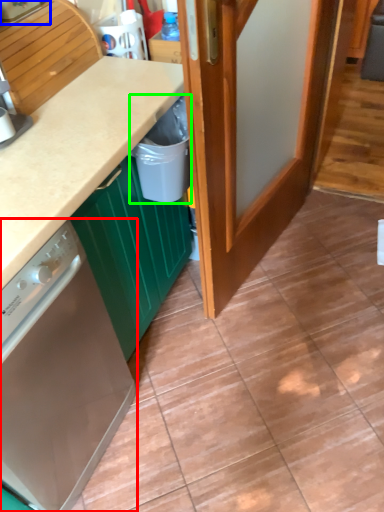
Question: Based on their relative distances, which object is nearer to home appliance (highlighted by a red box)? Choose from kitchen appliance (highlighted by a blue box) and recycling bin (highlighted by a green box).

Choices:
 (A) kitchen appliance
 (B) recycling bin

Answer: (B)